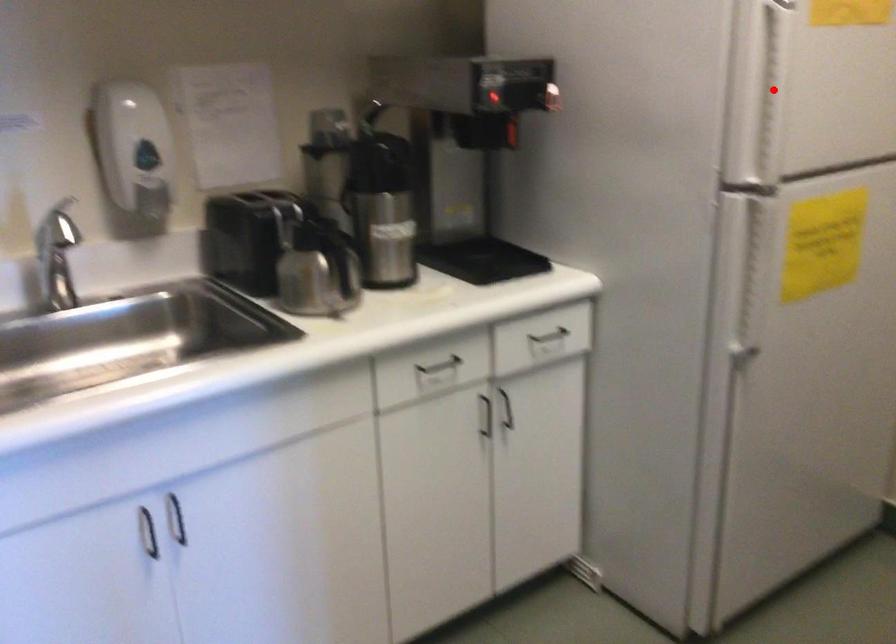
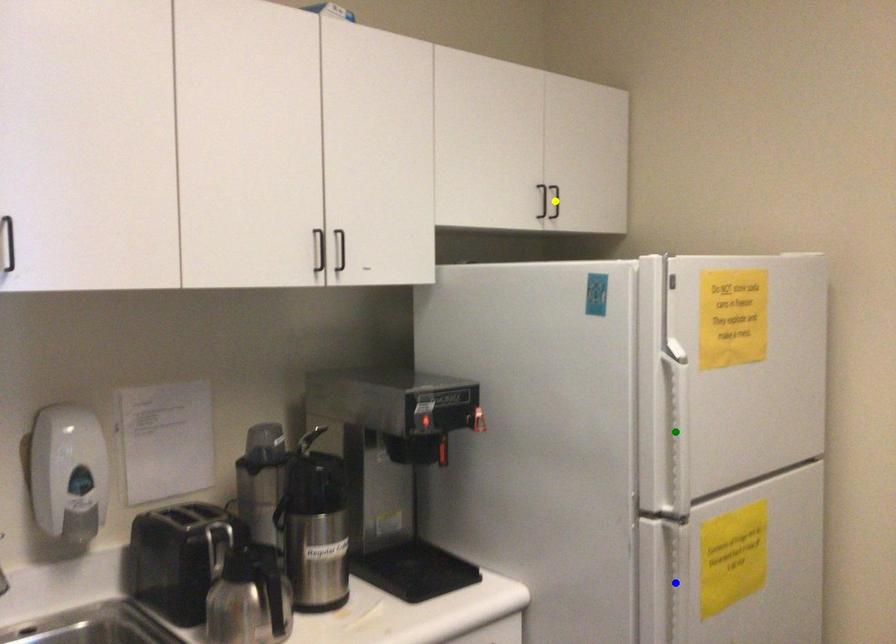
Question: I am providing you with two images of the same scene from different viewpoints. A red point is marked on the first image. You are given multiple points on the second image. Which spot in image 2 lines up with the point in image 1?

Choices:
 (A) green point
 (B) blue point
 (C) yellow point

Answer: (A)